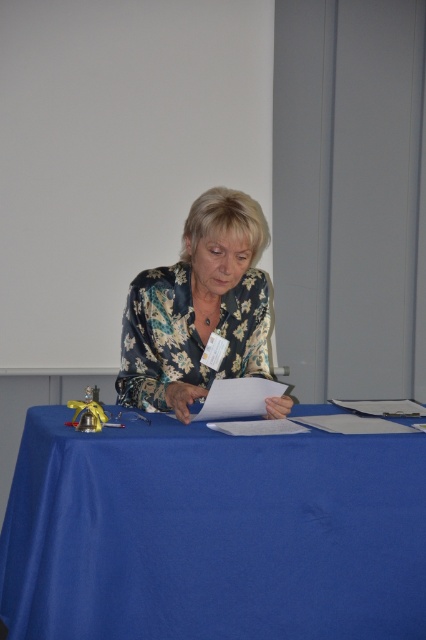
Who is more forward, [112,621] or [132,400]?

Point [112,621] is in front.

How far apart are blue fabric table at center and floral-patterned blouse at center?

They are 15.49 inches apart.

Is point (155, 456) farther from camera compared to point (267, 408)?

No, (155, 456) is closer to viewer.

Find the location of a particular element. The image size is (426, 640). blue fabric table at center is located at coordinates (212, 532).